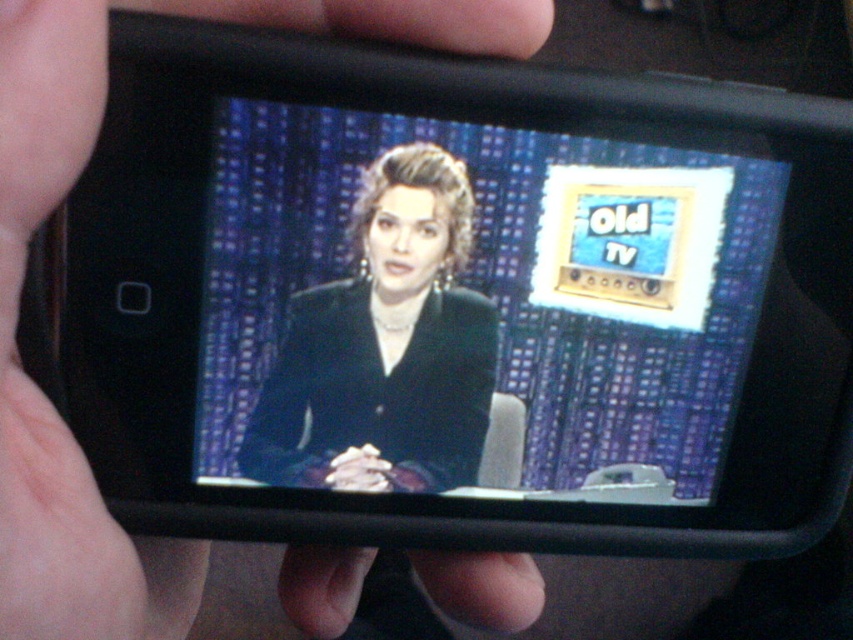
Which of these two, shiny black screen at center or black matte skin at upper left, stands shorter?

shiny black screen at center

Is point (207, 371) in front of point (67, 22)?

That is False.

You are a GUI agent. You are given a task and a screenshot of the screen. Output one action in this format:
    pyautogui.click(x=<x>, y=<y>)
    Task: Click on the shiny black screen at center
    
    Given the screenshot: What is the action you would take?
    pyautogui.click(x=474, y=307)

Which is behind, point (189, 589) or point (339, 324)?

The point (189, 589) is behind.

Which is in front, point (59, 92) or point (405, 180)?

Positioned in front is point (59, 92).

Is point (12, 326) positioned after point (419, 433)?

No, it is not.

At what (x,y) coordinates should I click in order to perform the action: click on black matte skin at upper left. Please return your answer as a coordinate pair (x, y). Image resolution: width=853 pixels, height=640 pixels. Looking at the image, I should click on (22, 275).

Which is more to the left, shiny black screen at center or black velvet suit at center?

black velvet suit at center

Does shiny black screen at center lie behind black velvet suit at center?

That is False.

You are a GUI agent. You are given a task and a screenshot of the screen. Output one action in this format:
    pyautogui.click(x=<x>, y=<y>)
    Task: Click on the shiny black screen at center
    
    Given the screenshot: What is the action you would take?
    pyautogui.click(x=474, y=307)